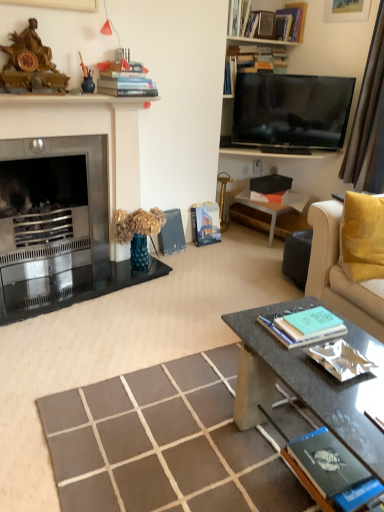
Find the location of a particular element. This screenshot has height=512, width=384. free space in front of teal matte book at center, the 3th book when ordered from bottom to top is located at coordinates (295, 362).